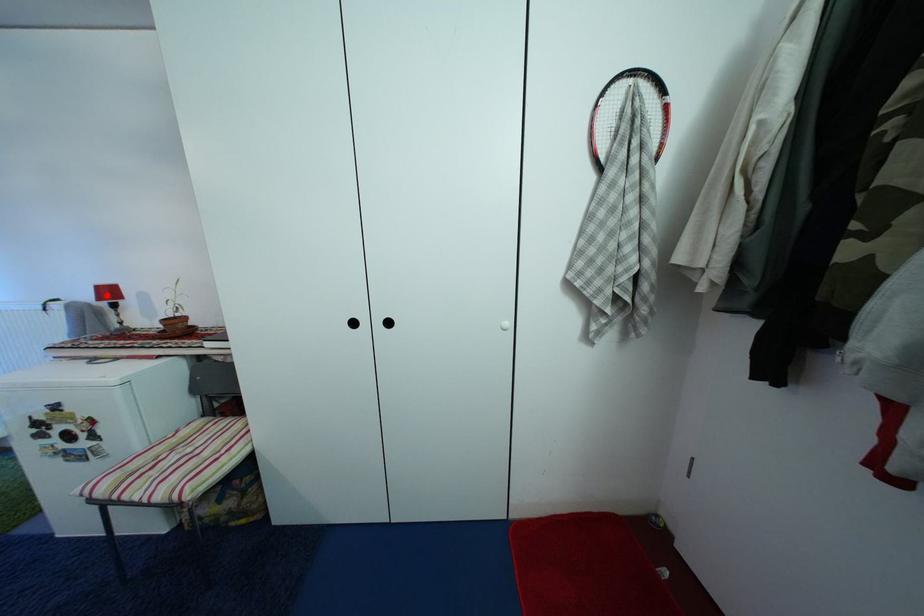
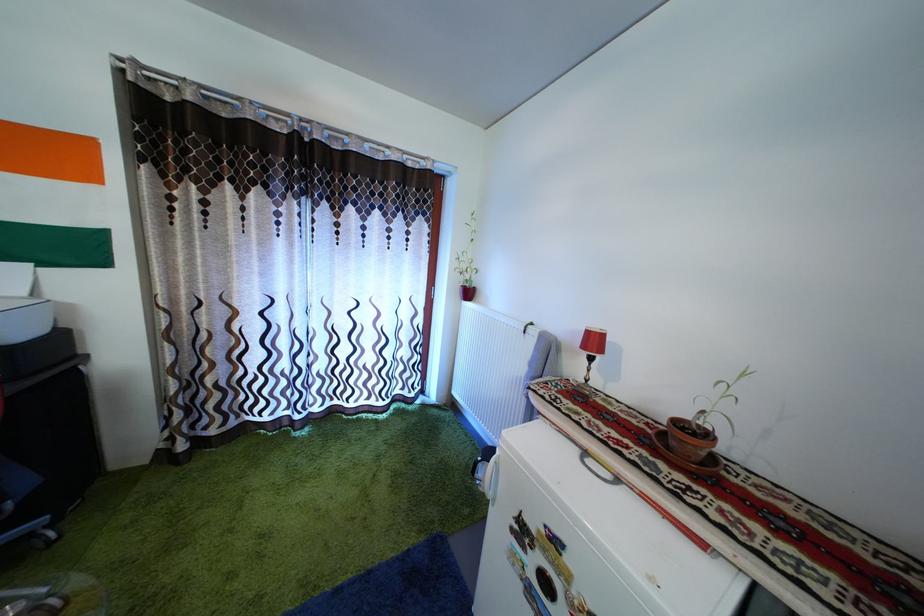
Where in the second image is the point corresponding to the highlighted location from the first image?

(598, 339)